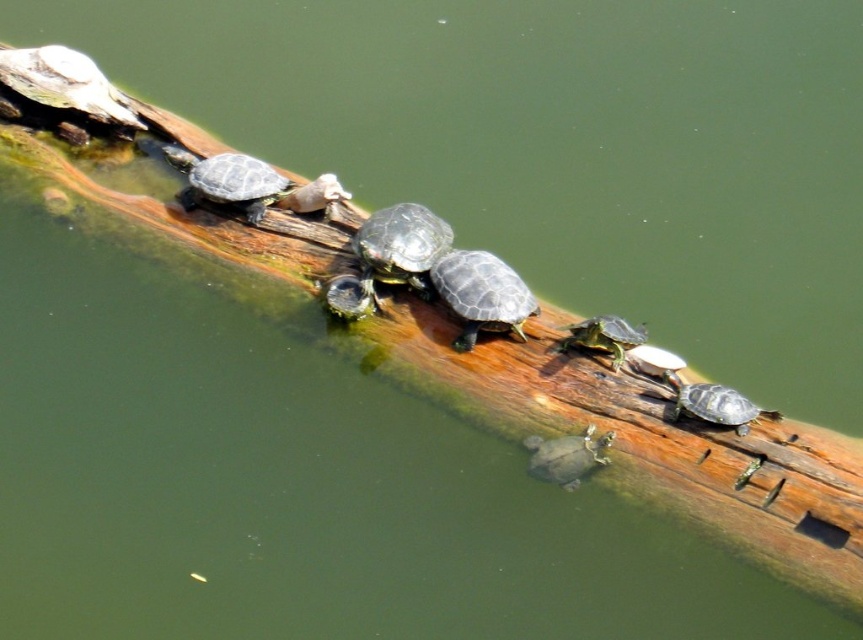
Is shiny green tortoise at center to the right of green matte turtle at center from the viewer's perspective?

Indeed, shiny green tortoise at center is positioned on the right side of green matte turtle at center.

Which is behind, point (600, 321) or point (375, 305)?

Point (375, 305)

Is point (602, 344) farther from camera compared to point (341, 296)?

That is False.

Locate an element on the screen. shiny green tortoise at center is located at coordinates (603, 337).

Is shiny dark green tortoise at upper center to the right of smooth gray tortoise at center from the viewer's perspective?

In fact, shiny dark green tortoise at upper center is to the left of smooth gray tortoise at center.

Does point (164, 150) come farther from viewer compared to point (628, 356)?

That is True.

Measure the distance between shiny dark green tortoise at upper center and camera.

The distance of shiny dark green tortoise at upper center from camera is 3.07 meters.

Identify the location of shiny dark green tortoise at upper center. (228, 180).

Is point (531, 474) more distant than point (338, 292)?

That is False.

Is smooth dark green tortoise at center positioned behind green matte turtle at center?

No, it is not.

This screenshot has height=640, width=863. What do you see at coordinates (567, 456) in the screenshot?
I see `smooth dark green tortoise at center` at bounding box center [567, 456].

Identify the location of smooth dark green tortoise at center. The width and height of the screenshot is (863, 640). (567, 456).